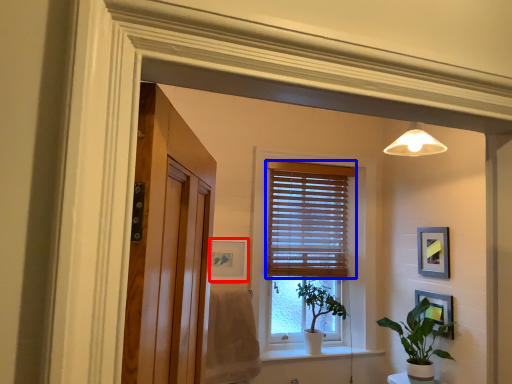
Question: Which of the following is the closest to the observer, picture frame (highlighted by a red box) or window blind (highlighted by a blue box)?

Choices:
 (A) picture frame
 (B) window blind

Answer: (A)